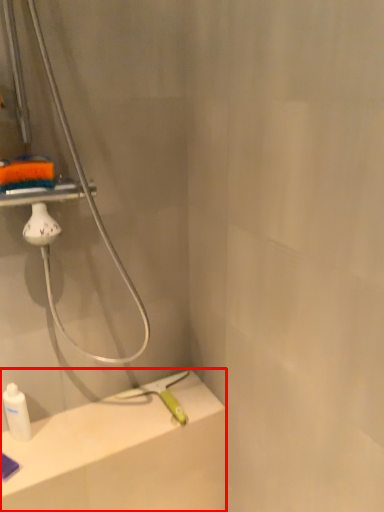
Question: Considering the relative positions of counter top (annotated by the red box) and bottle in the image provided, where is counter top (annotated by the red box) located with respect to the staircase?

Choices:
 (A) right
 (B) left

Answer: (A)